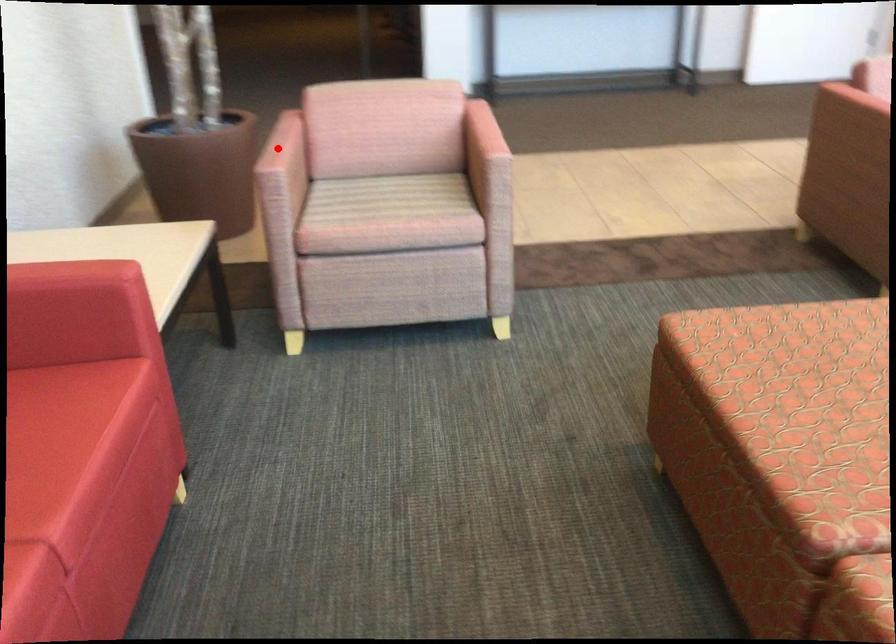
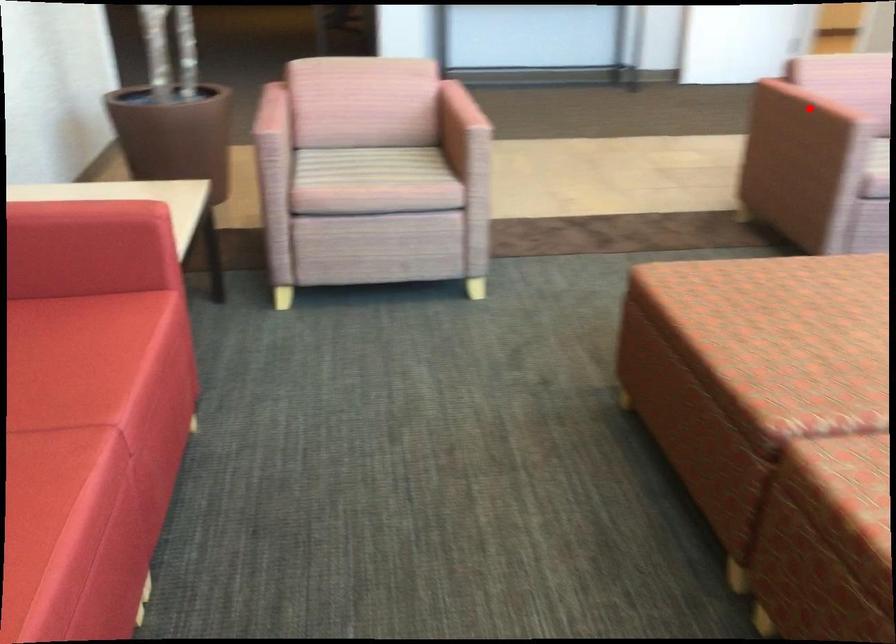
I am providing you with two images of the same scene from different viewpoints. A red point is marked on the first image and another point is marked on the second image. Do the highlighted points in image1 and image2 indicate the same real-world spot?

No